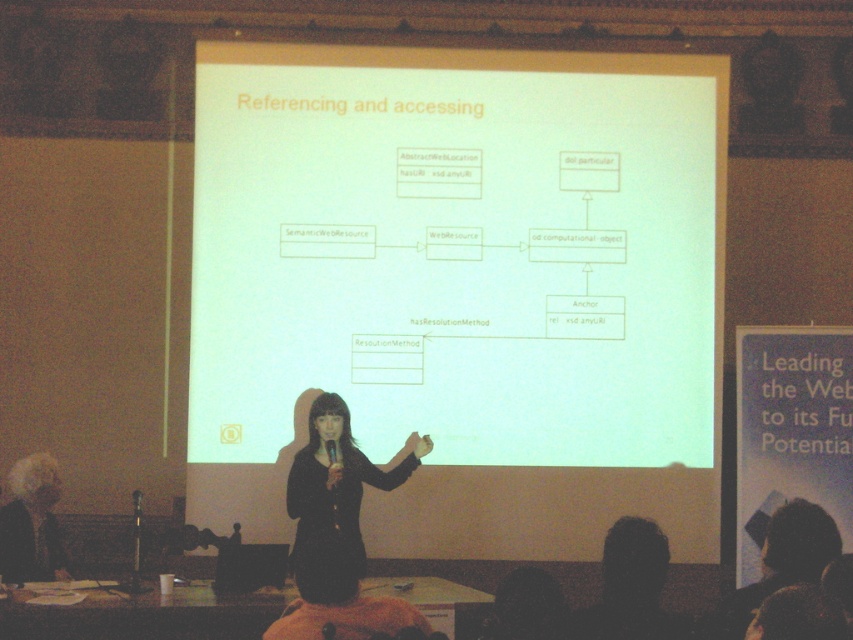
You are attending a presentation and want to focus on the slide. Which object should you look at first, the white matte projector screen at center or the black fabric at center?

You should look at the white matte projector screen at center first because it is located above the black fabric at center, making it more visible in the presentation setting.

You are a stagehand who needs to adjust the lighting for the presentation. You have a spotlight that has a minimum distance requirement of 6 feet to properly illuminate an object. You need to decide whether the spotlight can be placed at the same position as the black fabric at center to illuminate the white matte projector screen at center. Based on the given information, can the spotlight be positioned there?

The distance between the white matte projector screen at center and the black fabric at center is 7.36 feet. Since the spotlight requires a minimum of 6 feet to illuminate the screen, placing it at the black fabric at center would satisfy this requirement. Therefore, the spotlight can be positioned there.

You are an event organizer who needs to ensure that the projector screen is large enough to be visible to all attendees. Given that the black fabric is part of the stage backdrop, can you confirm if the white matte projector screen at center is smaller than the black fabric at center?

The white matte projector screen at center occupies less space than black fabric at center, so yes, the projector screen is smaller than the black fabric.